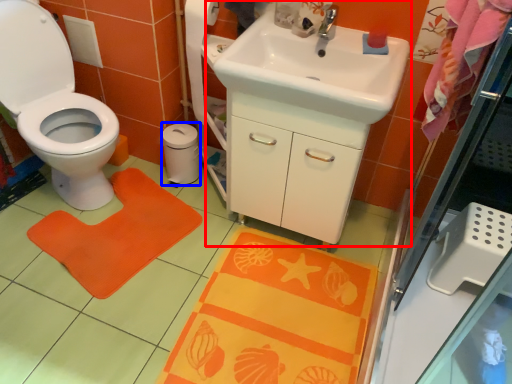
Question: Which of the following is the farthest to the observer, sink (highlighted by a red box) or toilet paper (highlighted by a blue box)?

Choices:
 (A) sink
 (B) toilet paper

Answer: (B)